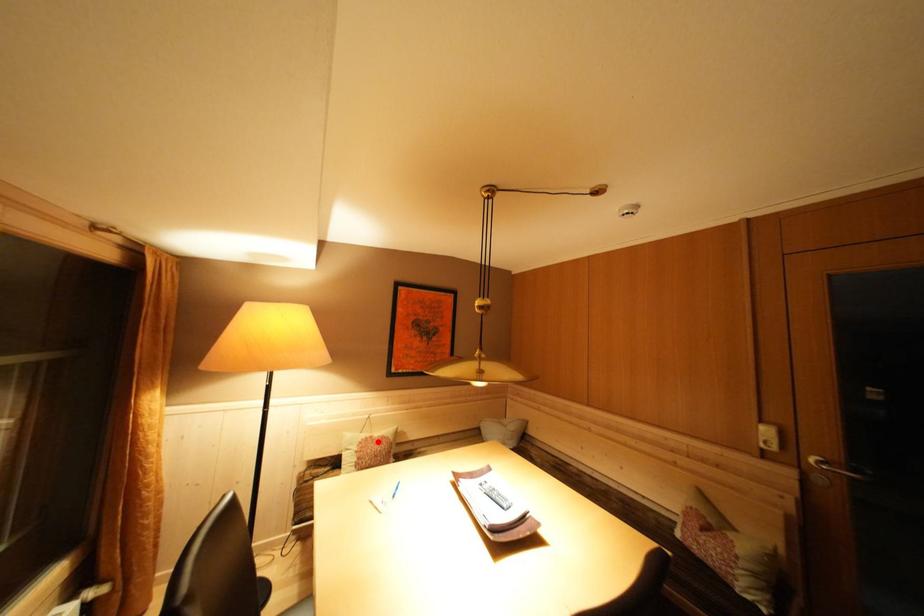
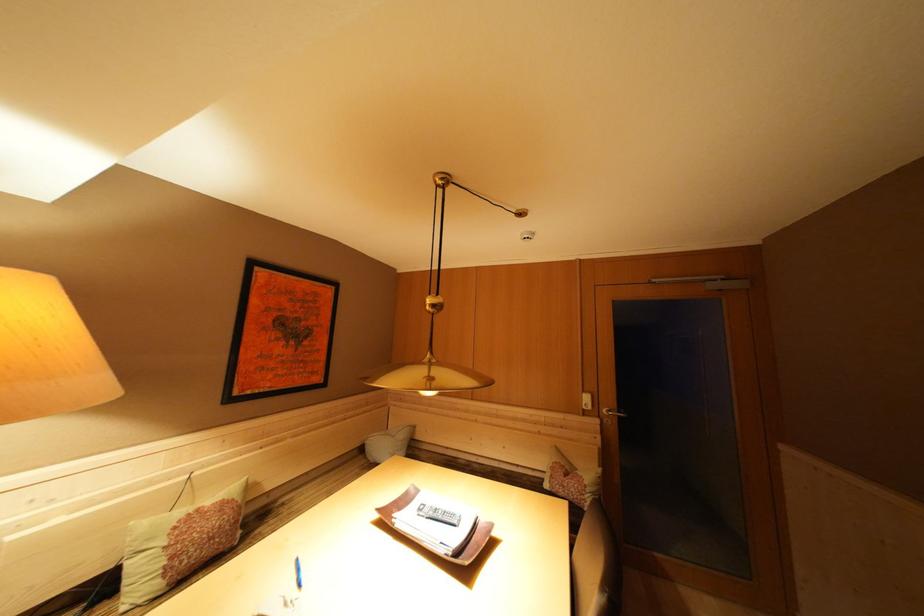
Locate, in the second image, the point that corresponds to the highlighted location in the first image.

(204, 515)